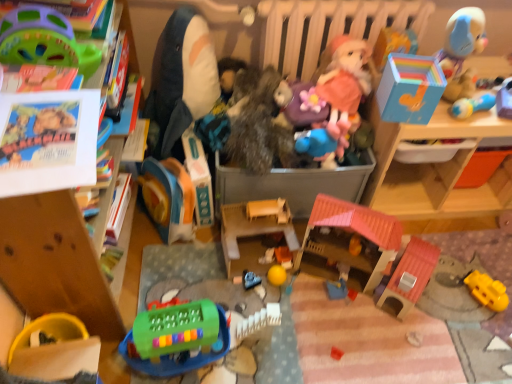
Locate an element on the screen. This screenshot has width=512, height=384. free space to the right of smooth orange block at center, the tenth toy positioned from the left is located at coordinates (318, 279).